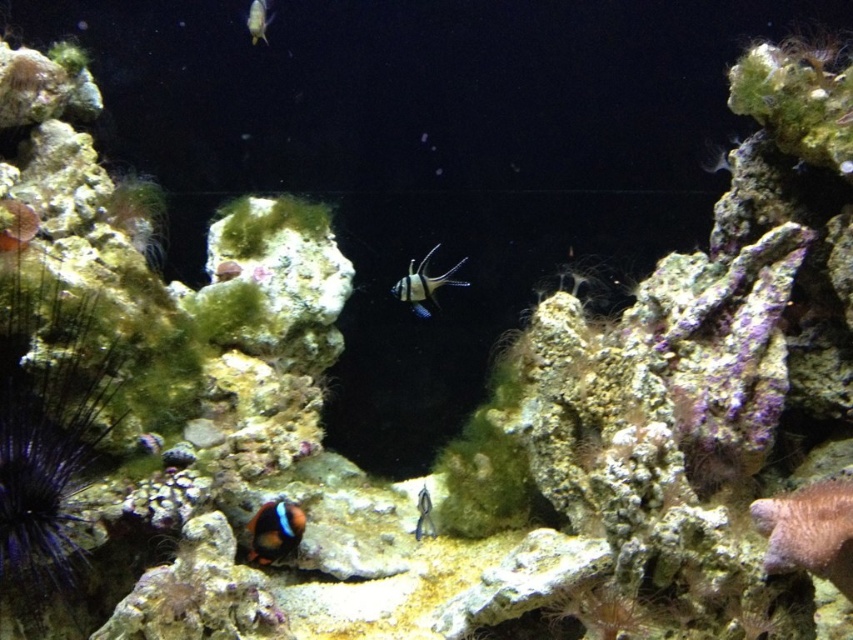
Question: Is black glossy fish at center closer to the viewer compared to translucent glass fish at upper center?

Choices:
 (A) no
 (B) yes

Answer: (A)

Question: Based on their relative distances, which object is farther from the translucent glass fish at upper center?

Choices:
 (A) orange and black clownfish at lower center
 (B) black glossy fish at center
 (C) translucent glass fish at center

Answer: (C)

Question: Does black glossy fish at center appear over translucent glass fish at upper center?

Choices:
 (A) no
 (B) yes

Answer: (A)

Question: Which object is the closest to the translucent glass fish at upper center?

Choices:
 (A) translucent glass fish at center
 (B) black glossy fish at center
 (C) orange and black clownfish at lower center

Answer: (B)

Question: Can you confirm if translucent glass fish at upper center is positioned to the left of translucent glass fish at center?

Choices:
 (A) yes
 (B) no

Answer: (A)

Question: Estimate the real-world distances between objects in this image. Which object is farther from the orange and black clownfish at lower center?

Choices:
 (A) black glossy fish at center
 (B) translucent glass fish at center

Answer: (A)